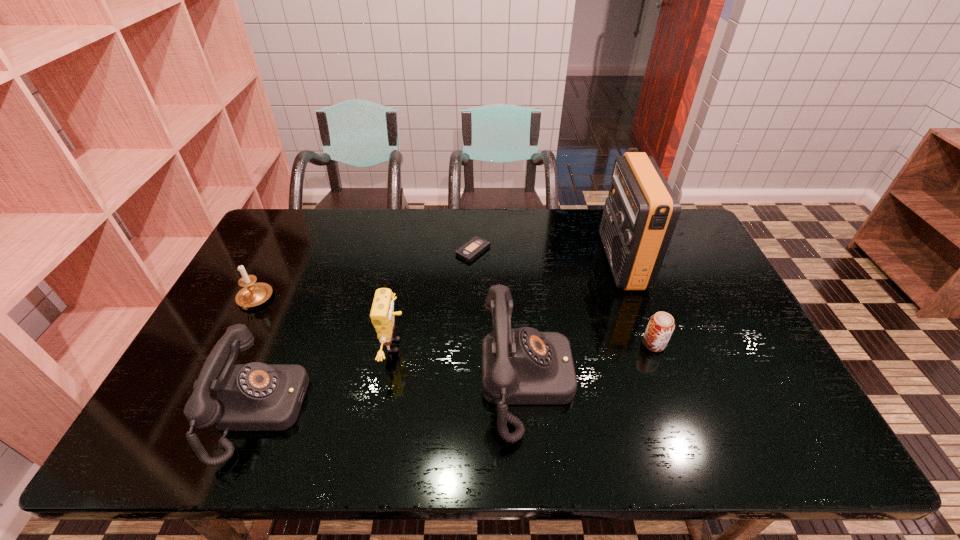
Please show where to add a telephone on the right while keeping spacing even. Please provide its 2D coordinates. Your answer should be formatted as a tuple, i.e. [(x, y)], where the tuple contains the x and y coordinates of a point satisfying the conditions above.

[(768, 355)]